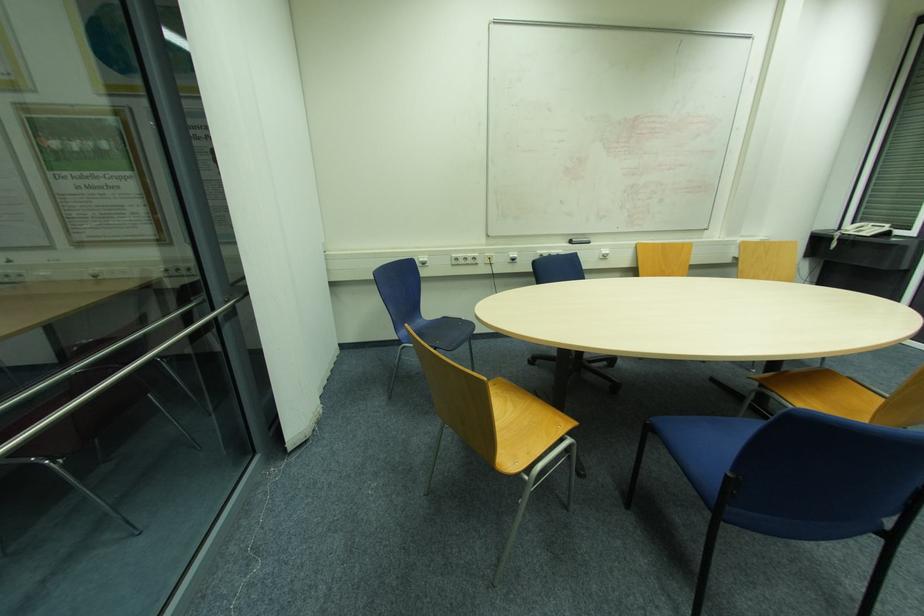
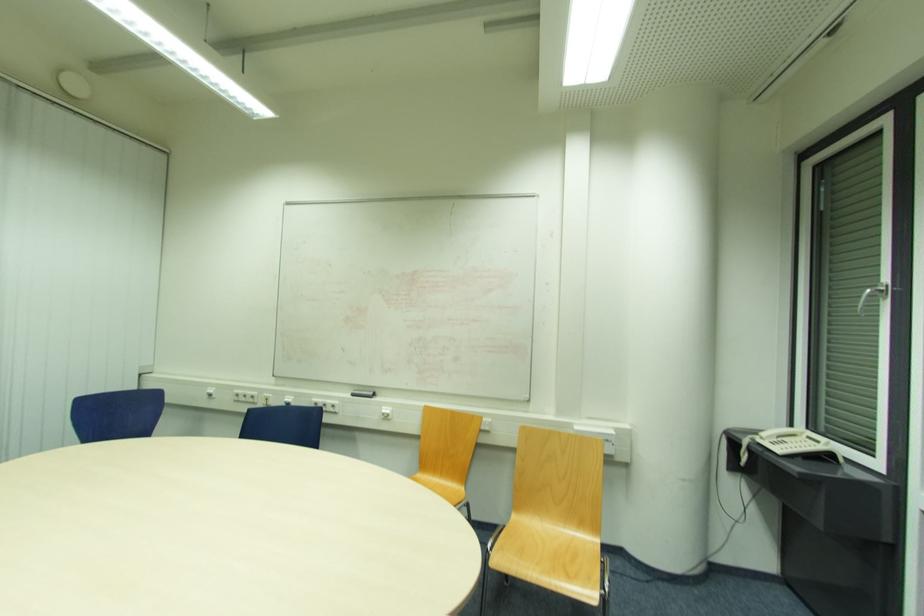
Where in the second image is the point corresponding to point 862,227 from the first image?

(793, 436)